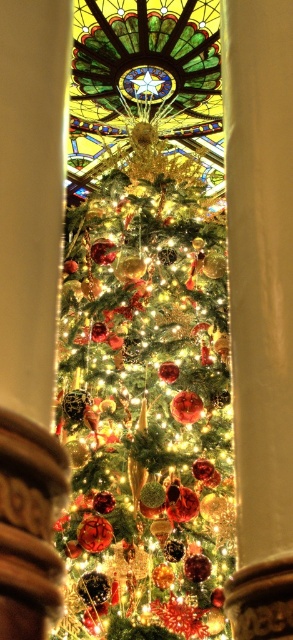
You are a photographer trying to capture a closeup of the glossy glass ornaments at center and the stained glass at center through the window. Since your camera can only focus on one object at a time, which object should you choose to ensure it fills the frame more effectively?

The glossy glass ornaments at center has a larger size compared to the stained glass at center, so you should choose the glossy glass ornaments at center to ensure it fills the frame more effectively.

You are a visitor standing in front of the arched window. You notice two items at the center of the scene. Which one is taller between the glossy glass ornaments at center and the stained glass at center?

The glossy glass ornaments at center is much taller than the stained glass at center according to the description.

You are standing in front of the arched window and want to see the stained glass at center. Is the glossy glass ornaments at center blocking your view of it?

The glossy glass ornaments at center is in front of stained glass at center, so it is blocking your view of the stained glass at center.